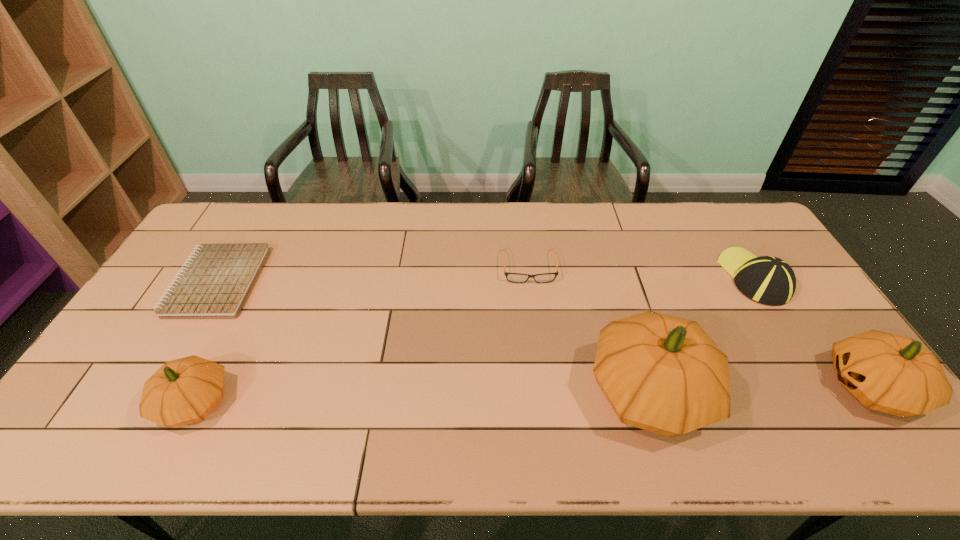
Locate an element on the screen. free space located on the back of the notebook is located at coordinates (x=246, y=233).

At what (x,y) coordinates should I click in order to perform the action: click on vacant position located on the front-facing side of the fourth object from right to left. Please return your answer as a coordinate pair (x, y). The height and width of the screenshot is (540, 960). Looking at the image, I should click on (543, 395).

The height and width of the screenshot is (540, 960). Identify the location of object at the left edge. (215, 283).

The height and width of the screenshot is (540, 960). In order to click on gourd that is at the right edge in this screenshot , I will do `click(894, 374)`.

Where is `baseball cap that is at the right edge`? This screenshot has height=540, width=960. baseball cap that is at the right edge is located at coordinates click(769, 280).

Identify the location of object positioned at the near right corner. The width and height of the screenshot is (960, 540). (894, 374).

Where is `vacant space at the far edge of the desktop`? This screenshot has height=540, width=960. vacant space at the far edge of the desktop is located at coordinates (651, 207).

This screenshot has height=540, width=960. What are the coordinates of `free space at the near edge of the desktop` in the screenshot? It's located at (238, 391).

Identify the location of vacant space at the right edge of the desktop. This screenshot has height=540, width=960. (810, 306).

Identify the location of free space at the far right corner. The image size is (960, 540). (742, 207).